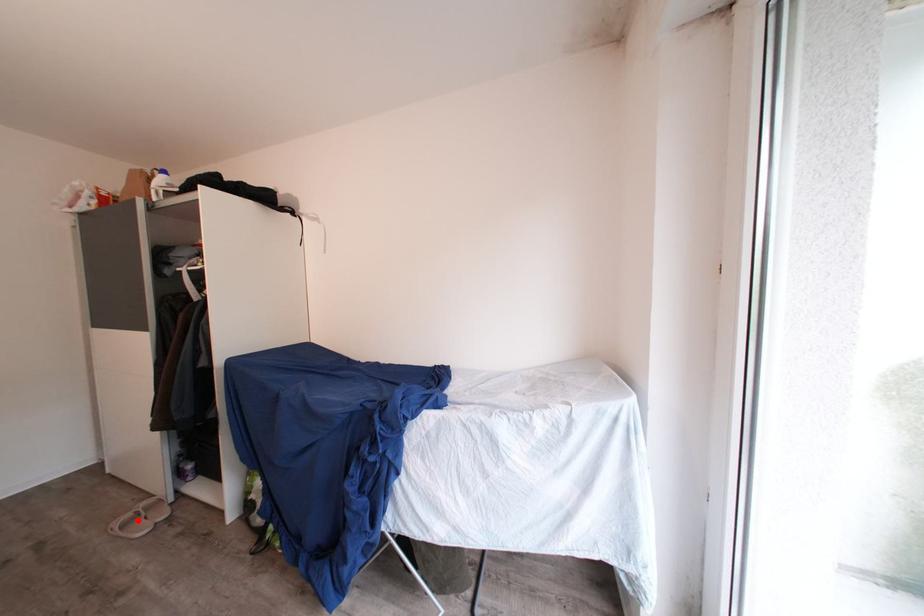
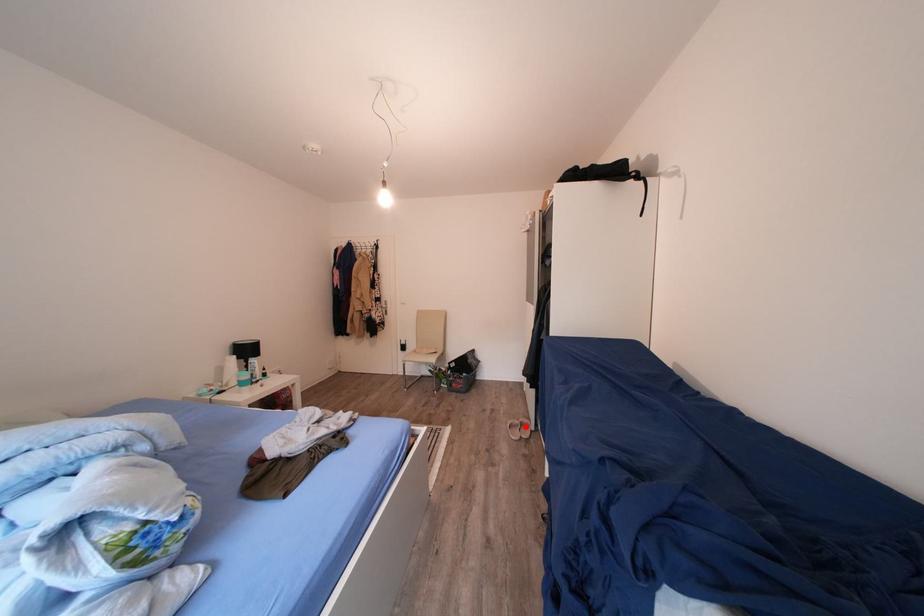
I am providing you with two images of the same scene from different viewpoints. A red point is marked on the first image and another point is marked on the second image. Do the highlighted points in image1 and image2 indicate the same real-world spot?

Yes